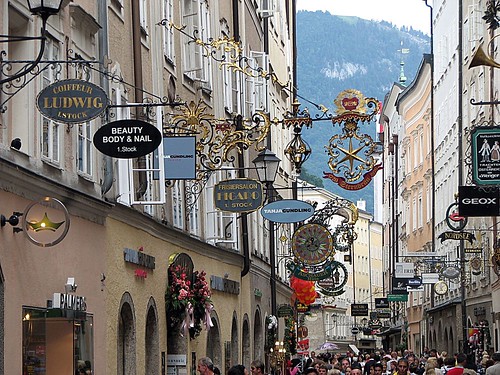
Identify the location of closed windows. (53, 128), (84, 146), (179, 219), (190, 222), (171, 50).